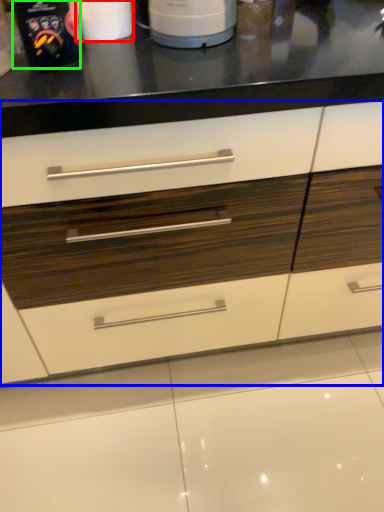
Question: Considering the real-world distances, which object is farthest from paper towel (highlighted by a red box)? drawer (highlighted by a blue box) or kitchen appliance (highlighted by a green box)?

Choices:
 (A) drawer
 (B) kitchen appliance

Answer: (A)